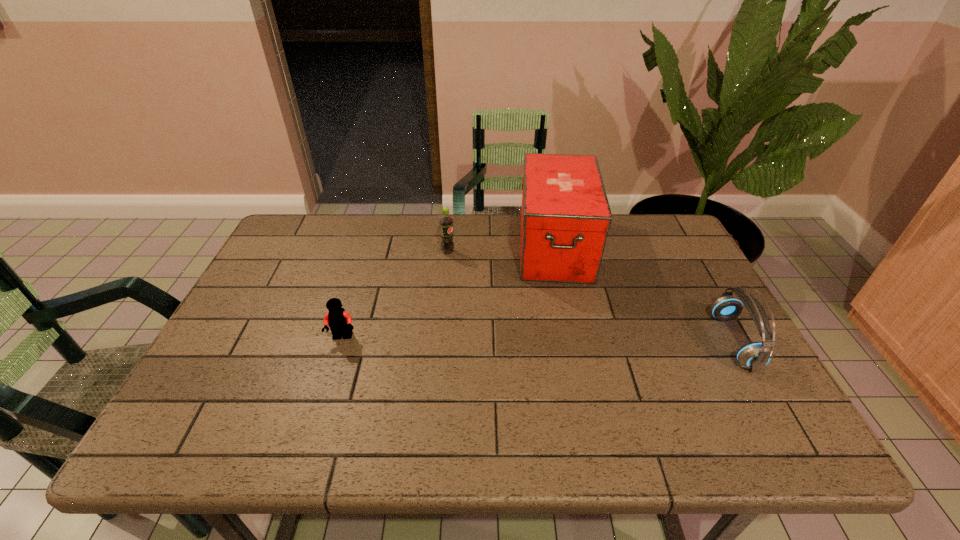
Find the location of a particular element. Image resolution: width=960 pixels, height=540 pixels. free space that satisfies the following two spatial constraints: 1. on the front-facing side of the Lego; 2. on the ear cups of the rightmost object is located at coordinates (342, 341).

Locate an element on the screen. The width and height of the screenshot is (960, 540). free location that satisfies the following two spatial constraints: 1. on the back side of the first-aid kit; 2. on the right side of the second object from left to right is located at coordinates (448, 246).

This screenshot has height=540, width=960. I want to click on free location that satisfies the following two spatial constraints: 1. on the front-facing side of the rightmost object; 2. on the ear cups of the shortest object, so click(x=342, y=341).

The height and width of the screenshot is (540, 960). I want to click on vacant space that satisfies the following two spatial constraints: 1. on the back side of the second object from left to right; 2. on the left side of the third object from left to right, so click(448, 246).

At what (x,y) coordinates should I click in order to perform the action: click on vacant area in the image that satisfies the following two spatial constraints: 1. on the front side of the rightmost object; 2. on the ear cups of the third object from left to right. Please return your answer as a coordinate pair (x, y). The image size is (960, 540). Looking at the image, I should click on (575, 341).

Locate an element on the screen. Image resolution: width=960 pixels, height=540 pixels. blank area in the image that satisfies the following two spatial constraints: 1. on the front-facing side of the rightmost object; 2. on the ear cups of the leftmost object is located at coordinates (342, 341).